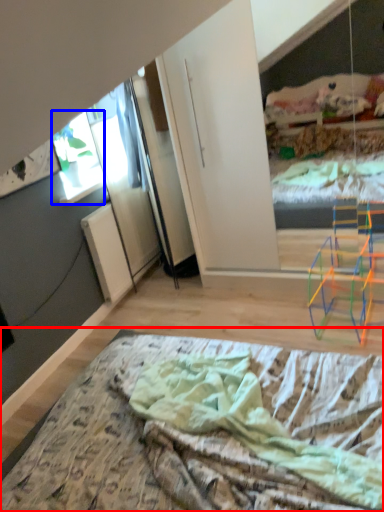
Question: Which of the following is the farthest to the observer, bed (highlighted by a red box) or window (highlighted by a blue box)?

Choices:
 (A) bed
 (B) window

Answer: (B)